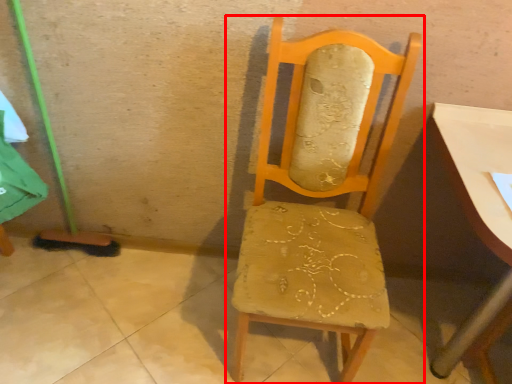
Question: Observing the image, what is the correct spatial positioning of chair (annotated by the red box) in reference to table?

Choices:
 (A) right
 (B) left

Answer: (B)